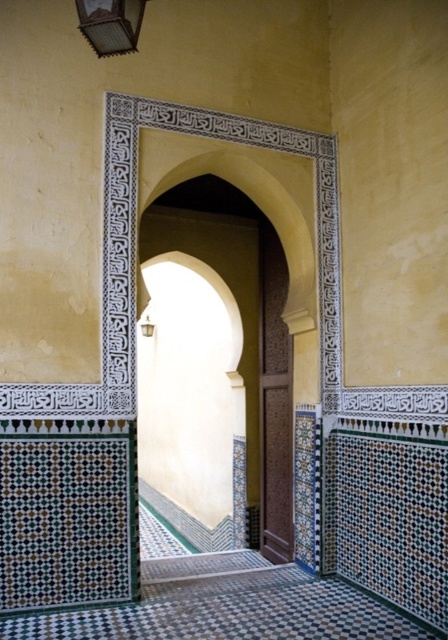
Consider the image. You are an architect designing a new Moroccan style room. You want to place a 4 meter long decorative pole between the brown carved wood door at center and the metallic glass at upper left. Will the pole fit between them?

The distance between the brown carved wood door at center and the metallic glass at upper left is 3.87 meters. Since the pole is 4 meters long, it will not fit between them as it is slightly longer than the available space.

You are an interior designer planning to install a new light fixture. You need to know the position of the brown carved wood door at center relative to the metallic glass at upper left. Can you describe their spatial relationship?

The brown carved wood door at center is located below the metallic glass at upper left.

You are an interior designer planning to install a new lighting fixture. You have two options available, a large chandelier and a small wall sconce. The brown carved wood door at center and the metallic glass at upper left are both in your line of sight. Which object would be more suitable for placing the large chandelier near, considering their sizes?

The brown carved wood door at center has a larger size compared to metallic glass at upper left, so the large chandelier would be more suitable to place near the brown carved wood door at center as it can accommodate the scale of the fixture.